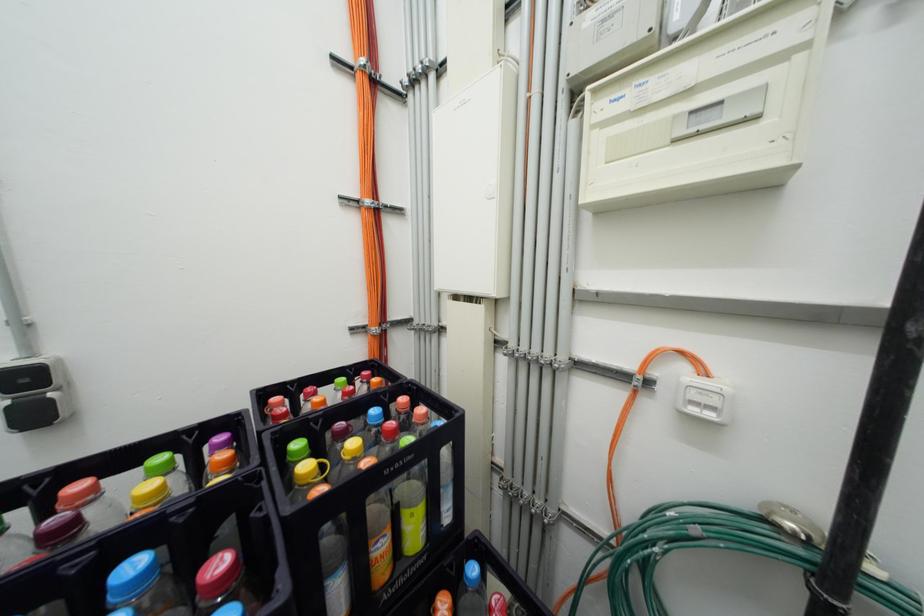
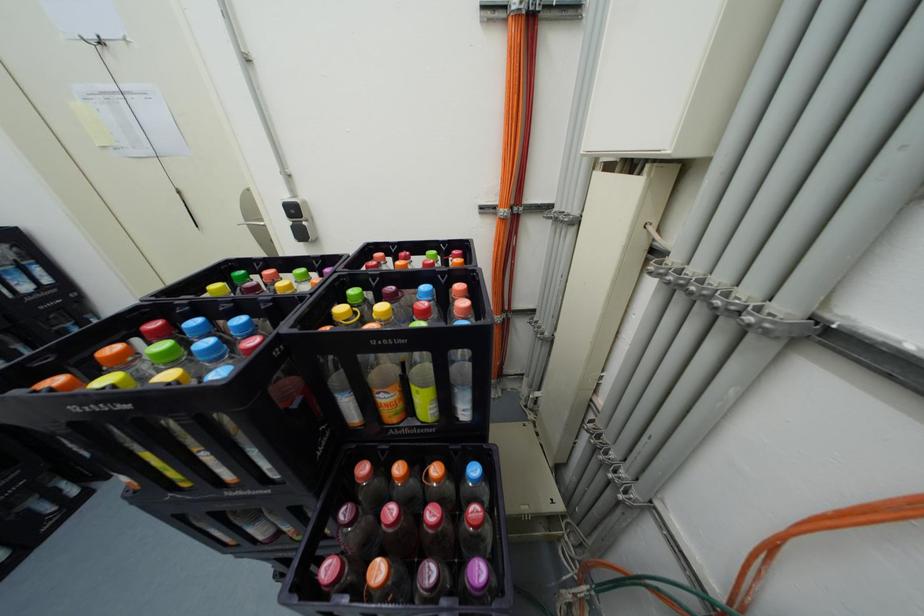
How did the camera likely rotate?

The camera's rotation is toward left-down.